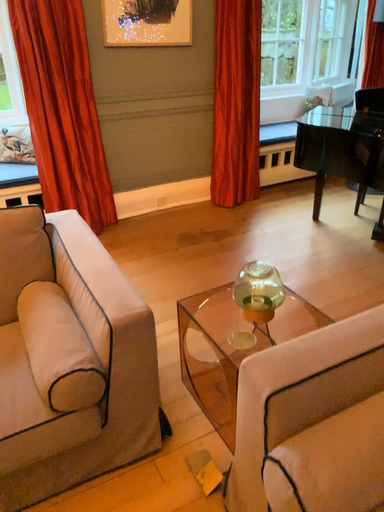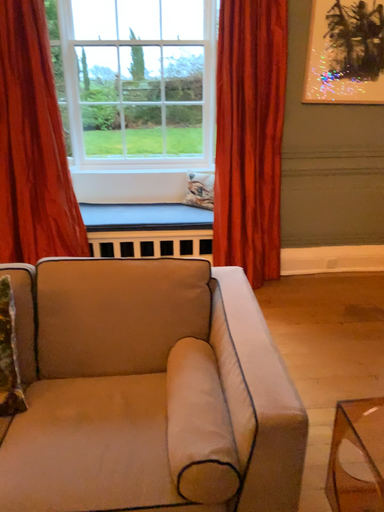
Question: Which way did the camera rotate in the video?

Choices:
 (A) rotated left
 (B) rotated right

Answer: (A)